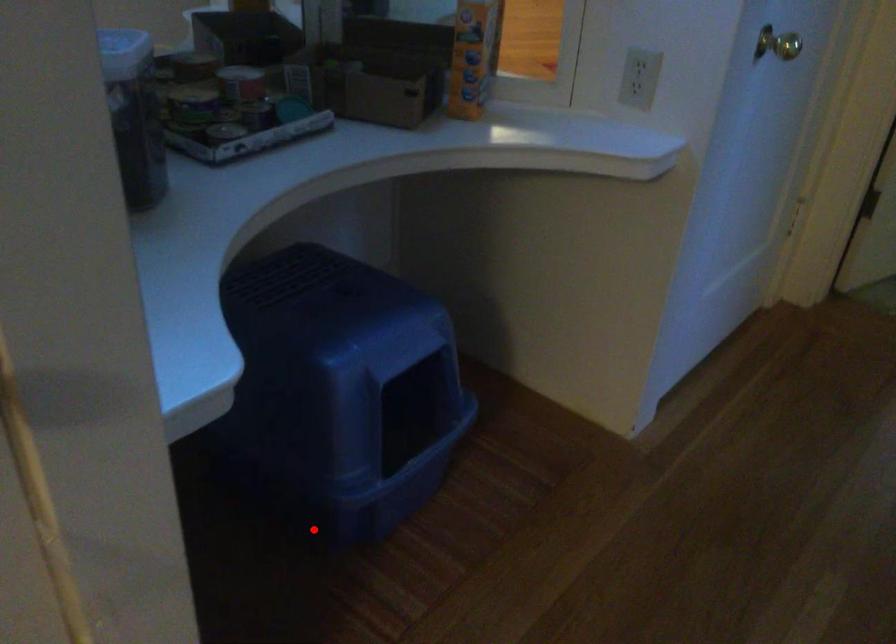
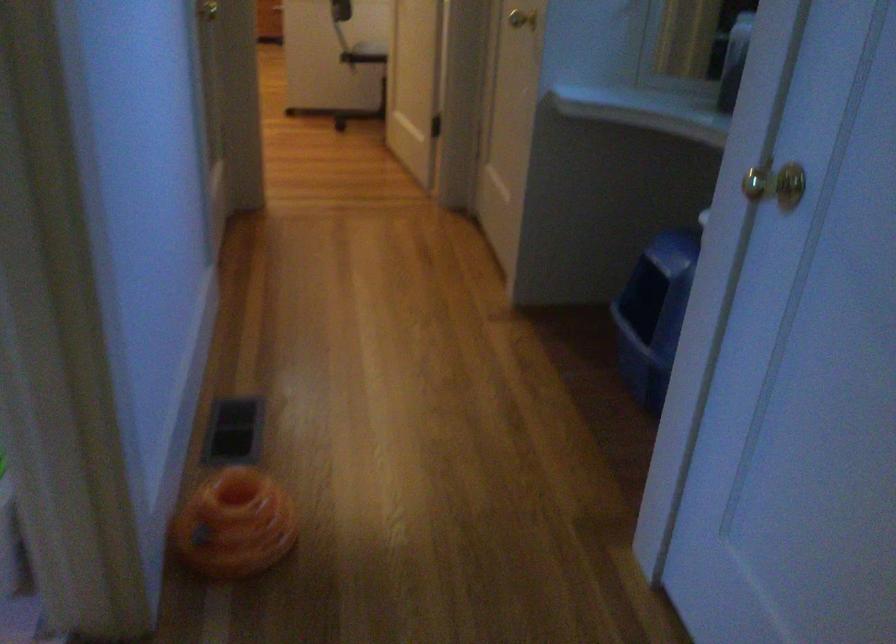
Question: I am providing you with two images of the same scene from different viewpoints. Given a red point in image1, look at the same physical point in image2. Is it:

Choices:
 (A) Closer to the viewpoint
 (B) Farther from the viewpoint

Answer: (B)